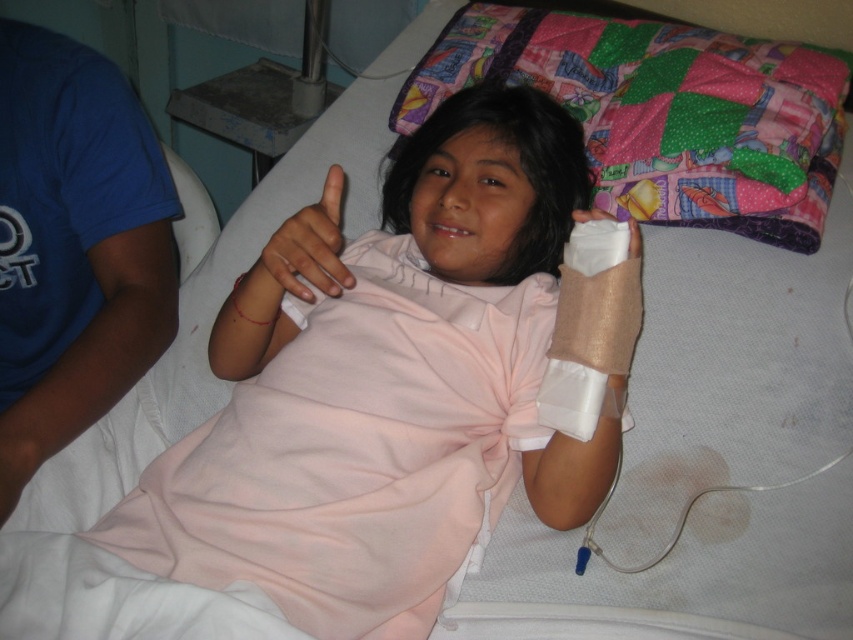
You are a nurse in the hospital room. You need to place a medical chart at point (339, 262) and a syringe at point (634, 234). From the patient lying in the bed, which item would appear closer?

The syringe at point (634, 234) would appear closer to the patient because point (634, 234) is in front of point (339, 262).

You are a nurse checking the hospital room. You need to determine if the patchwork quilt at upper center can be folded and placed under the beige textured bandage at lower right without overlapping. Based on their sizes, is this possible?

The patchwork quilt at upper center has a greater height compared to the beige textured bandage at lower right. Since the quilt is taller, it would not fit under the bandage without overlapping, so it is not possible.